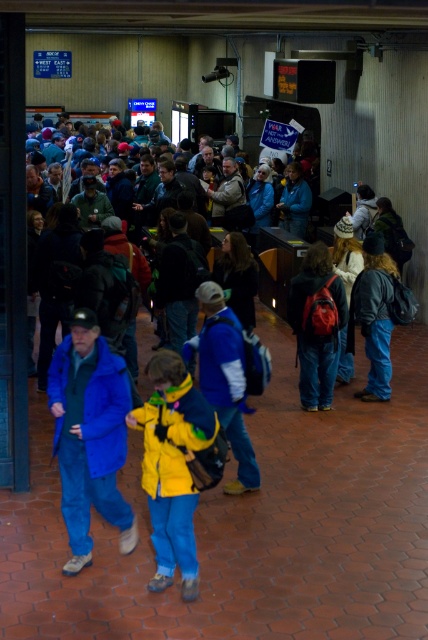
Which of these two, yellow matte jacket at center or matte red backpack at center, stands taller?

matte red backpack at center

Between yellow matte jacket at center and matte red backpack at center, which one appears on the right side from the viewer's perspective?

Positioned to the right is matte red backpack at center.

Is point (178, 557) behind point (293, 310)?

No, it is in front of (293, 310).

In order to click on yellow matte jacket at center in this screenshot , I will do `click(172, 465)`.

Can you confirm if blue fabric jacket at center is smaller than matte red backpack at center?

Incorrect, blue fabric jacket at center is not smaller in size than matte red backpack at center.

Which of these two, blue fabric jacket at center or matte red backpack at center, stands shorter?

blue fabric jacket at center

Which is in front, point (196, 296) or point (321, 244)?

Point (196, 296)

Image resolution: width=428 pixels, height=640 pixels. Find the location of `blue fabric jacket at center`. blue fabric jacket at center is located at coordinates [x=225, y=380].

Between blue denim jacket at center and denim jacket at right, which one is positioned lower?

blue denim jacket at center

Does blue denim jacket at center lie in front of denim jacket at right?

Yes, it is in front of denim jacket at right.

This screenshot has height=640, width=428. What do you see at coordinates (89, 435) in the screenshot?
I see `blue denim jacket at center` at bounding box center [89, 435].

You are a GUI agent. You are given a task and a screenshot of the screen. Output one action in this format:
    pyautogui.click(x=<x>, y=<y>)
    Task: Click on the blue denim jacket at center
    This screenshot has width=428, height=640.
    Given the screenshot: What is the action you would take?
    pyautogui.click(x=89, y=435)